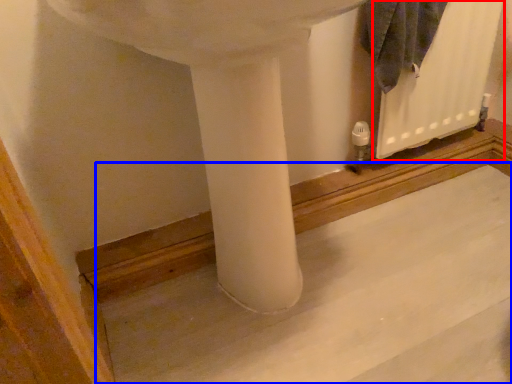
Question: Which object appears closest to the camera in this image, radiator (highlighted by a red box) or concrete (highlighted by a blue box)?

Choices:
 (A) radiator
 (B) concrete

Answer: (B)